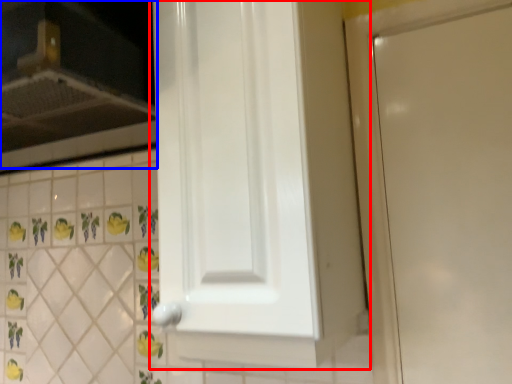
Question: Which point is further to the camera, door (highlighted by a red box) or vent (highlighted by a blue box)?

Choices:
 (A) door
 (B) vent

Answer: (B)